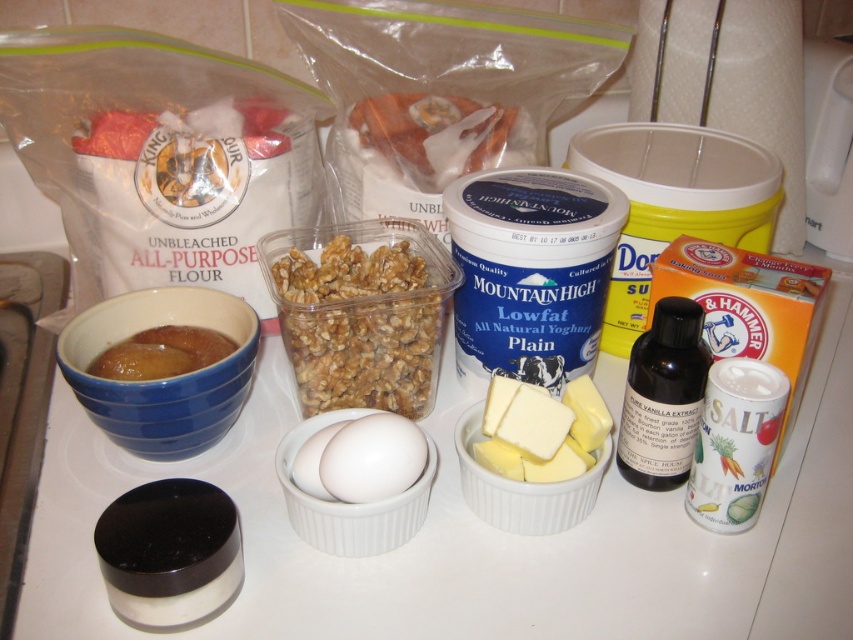
Question: Does clear plastic container of walnuts at center appear over brown glossy jam at left?

Choices:
 (A) no
 (B) yes

Answer: (B)

Question: Which object is closer to the camera taking this photo?

Choices:
 (A) blue matte container at center
 (B) yellow creamy butter at center
 (C) brown glossy jam at left
 (D) clear plastic container of walnuts at center

Answer: (B)

Question: In this image, where is blue matte container at center located relative to clear plastic container of walnuts at center?

Choices:
 (A) below
 (B) above

Answer: (B)

Question: Estimate the real-world distances between objects in this image. Which object is farther from the brown glossy jam at left?

Choices:
 (A) blue matte container at center
 (B) clear plastic container of walnuts at center

Answer: (A)

Question: Does clear plastic container of walnuts at center appear on the right side of yellow creamy butter at center?

Choices:
 (A) no
 (B) yes

Answer: (A)

Question: Among these points, which one is farthest from the camera?

Choices:
 (A) (115, 362)
 (B) (485, 172)
 (C) (570, 417)
 (D) (405, 323)

Answer: (B)